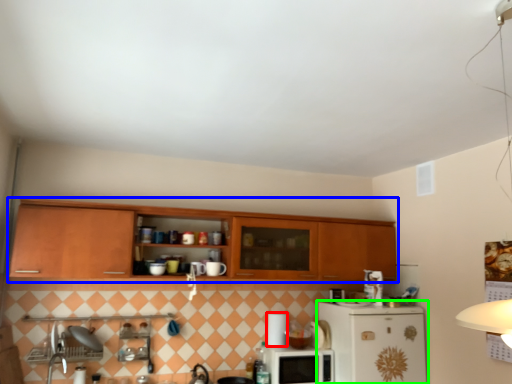
Question: Estimate the real-world distances between objects in this image. Which object is farther from appliance (highlighted by a red box), cabinetry (highlighted by a blue box) or refrigerator (highlighted by a green box)?

Choices:
 (A) cabinetry
 (B) refrigerator

Answer: (A)